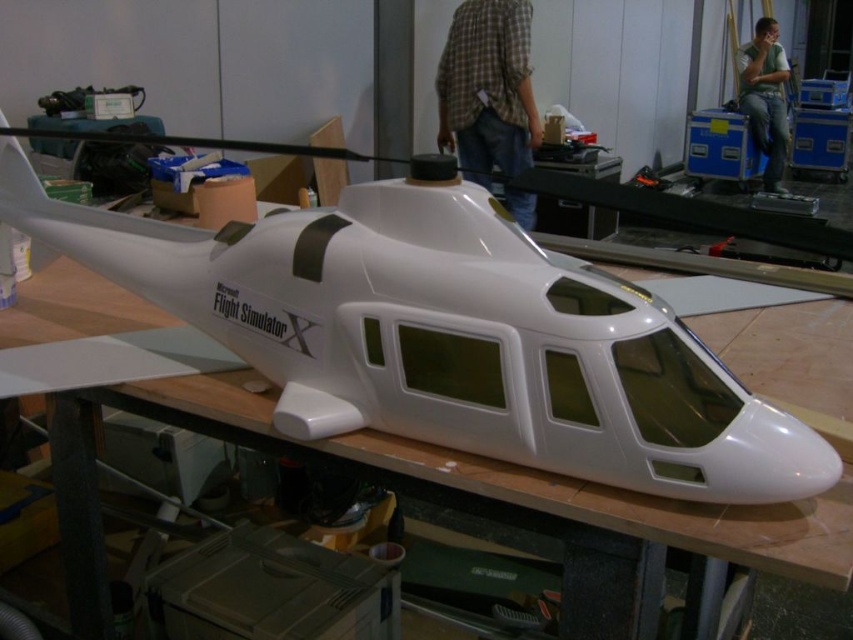
Does white glossy helicopter at center have a lesser height compared to green cotton shirt at upper right?

Yes, white glossy helicopter at center is shorter than green cotton shirt at upper right.

Does point (579, 348) come in front of point (781, 125)?

Yes, it is in front of point (781, 125).

This screenshot has height=640, width=853. I want to click on white glossy helicopter at center, so click(x=448, y=333).

Measure the distance from white glossy helicopter at center to plaid fabric shirt at upper center.

They are 3.21 meters apart.

Consider the image. Can you confirm if white glossy helicopter at center is shorter than plaid fabric shirt at upper center?

Correct, white glossy helicopter at center is not as tall as plaid fabric shirt at upper center.

Is point (231, 257) closer to viewer compared to point (488, 122)?

Yes, point (231, 257) is closer to viewer.

Find the location of a particular element. Image resolution: width=853 pixels, height=640 pixels. white glossy helicopter at center is located at coordinates (448, 333).

Does plaid fabric shirt at upper center appear over green cotton shirt at upper right?

Incorrect, plaid fabric shirt at upper center is not positioned above green cotton shirt at upper right.

Who is shorter, plaid fabric shirt at upper center or green cotton shirt at upper right?

plaid fabric shirt at upper center

The image size is (853, 640). I want to click on plaid fabric shirt at upper center, so click(486, 88).